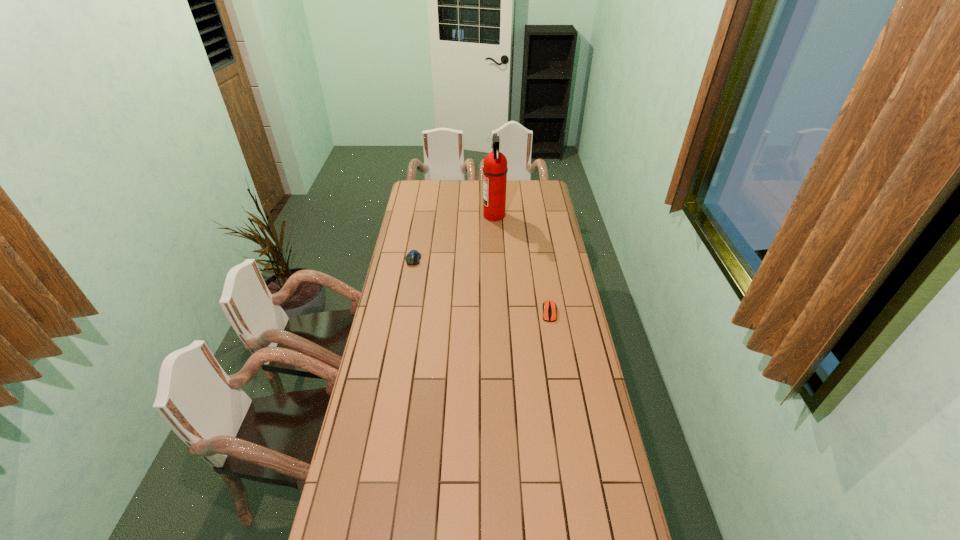
The width and height of the screenshot is (960, 540). I want to click on free location that satisfies the following two spatial constraints: 1. on the side of the nearest object near the handle; 2. on the right side of the farthest object, so pyautogui.click(x=498, y=312).

What are the coordinates of `blank area in the image that satisfies the following two spatial constraints: 1. on the side of the right computer mouse near the handle; 2. on the left side of the tallest object` in the screenshot? It's located at (498, 312).

The height and width of the screenshot is (540, 960). I want to click on free spot that satisfies the following two spatial constraints: 1. on the side of the fire extinguisher near the handle; 2. on the left side of the rightmost object, so click(498, 312).